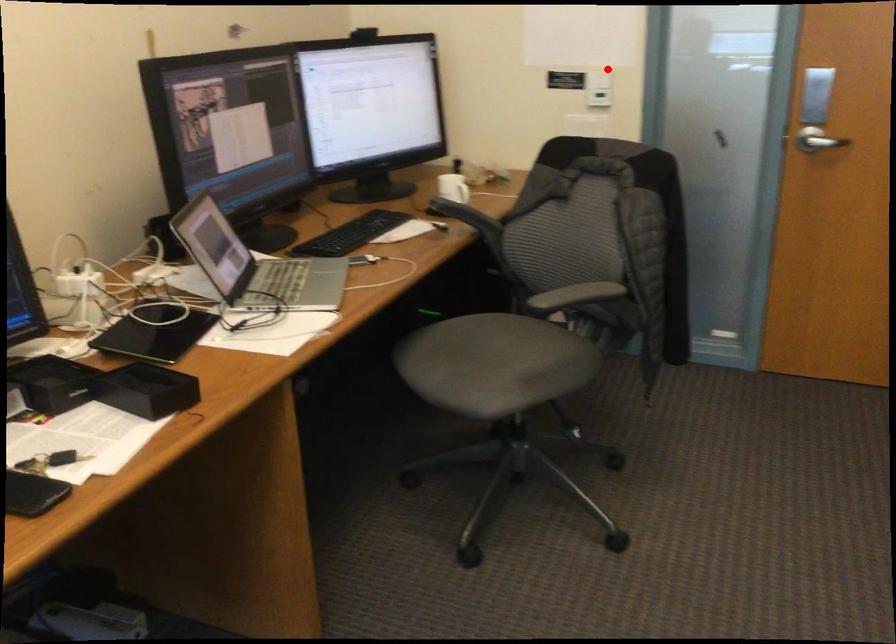
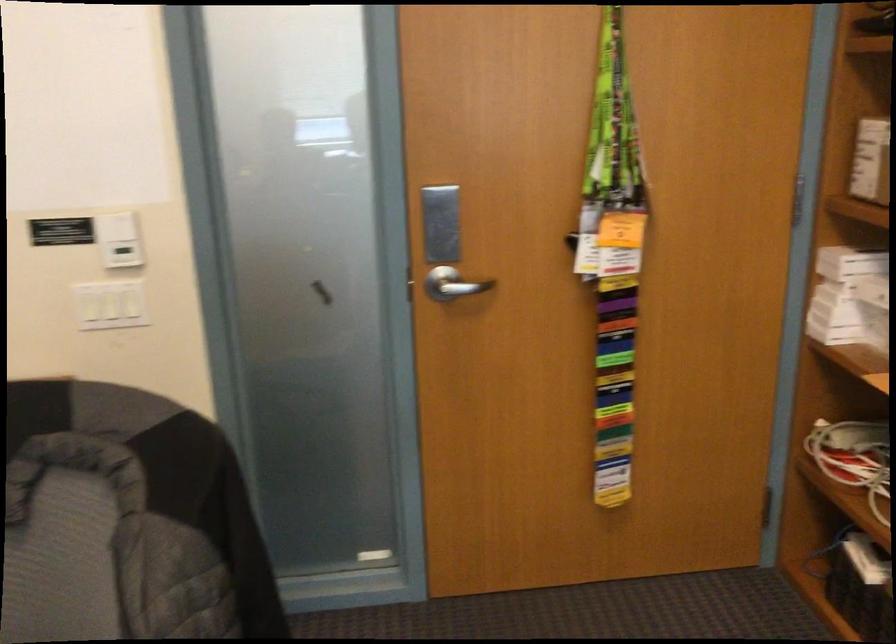
The point at the highlighted location is marked in the first image. Where is the corresponding point in the second image?

(116, 225)